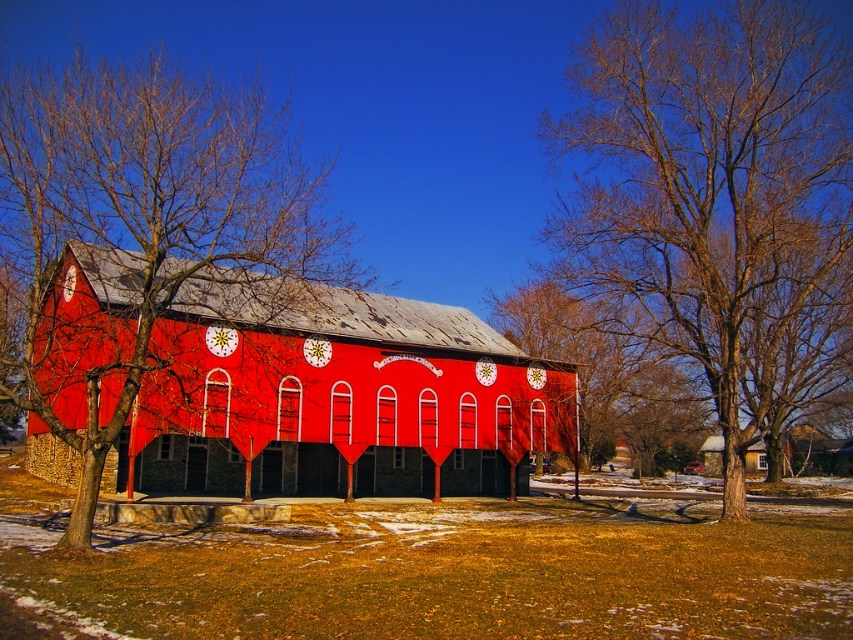
Which is below, matte red barn at center or bare branches at left?

matte red barn at center

Which is above, matte red barn at center or bare branches at left?

bare branches at left

Where is `matte red barn at center`? The image size is (853, 640). matte red barn at center is located at coordinates (335, 396).

Is the position of bare wood tree at center more distant than that of smooth wooden house at lower right?

No, bare wood tree at center is in front of smooth wooden house at lower right.

Is bare wood tree at center to the right of smooth wooden house at lower right from the viewer's perspective?

No, bare wood tree at center is not to the right of smooth wooden house at lower right.

Is point (785, 90) farther from viewer compared to point (715, 444)?

No, (785, 90) is closer to viewer.

I want to click on bare wood tree at center, so click(705, 180).

Is matte red barn at center wider than bare branches at center?

Yes, matte red barn at center is wider than bare branches at center.

Is point (120, 314) closer to camera compared to point (590, 440)?

Yes, point (120, 314) is closer to viewer.

Which is in front, point (47, 380) or point (701, 394)?

Point (47, 380) is more forward.

This screenshot has height=640, width=853. I want to click on matte red barn at center, so tap(335, 396).